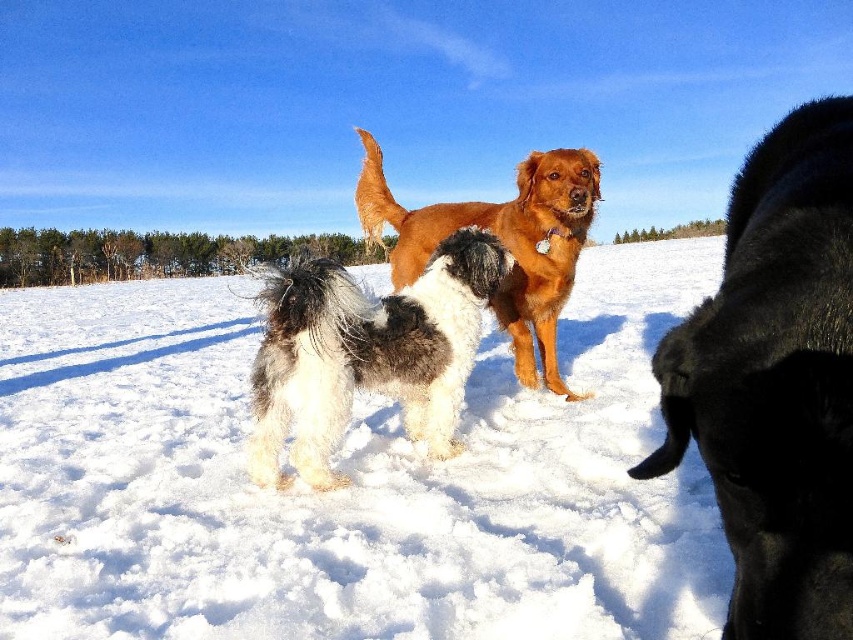
What is located at the point with coordinates (352, 481) in the winter scene?

The point at coordinates (352, 481) in the winter scene indicates white fluffy snow at center.

You are a photographer trying to capture a group photo of the black fur dog at right and the fluffy white and black dog at center. Based on their heights, which dog should you position closer to the camera to ensure both are fully visible in the photo?

The black fur dog at right is not as tall as the fluffy white and black dog at center, so you should position the black fur dog at right closer to the camera to ensure both are fully visible in the photo.